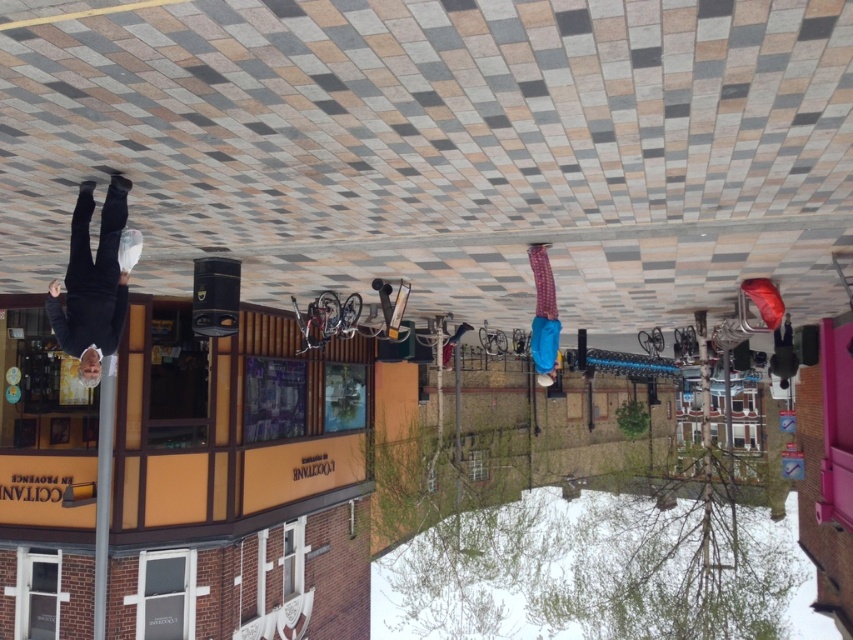
Looking at this image, you are a tailor observing the black matte pants at left and the plaid fabric pants at center in the image. Which pair of pants has a wider leg opening?

The plaid fabric pants at center has a wider leg opening than the black matte pants at left.

You are a pedestrian walking down the street and see the black matte pants at left and the plaid fabric pants at center. Which direction should you turn to see both pants in your line of sight?

You should turn to face the left side since the black matte pants at left are positioned to the left of the plaid fabric pants at center, allowing both to be seen in your line of sight when facing that direction.